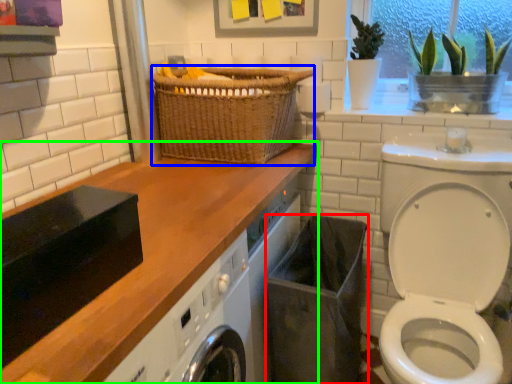
Question: Considering the real-world distances, which object is closest to laundry basket (highlighted by a red box)? basket (highlighted by a blue box) or countertop (highlighted by a green box).

Choices:
 (A) basket
 (B) countertop

Answer: (B)